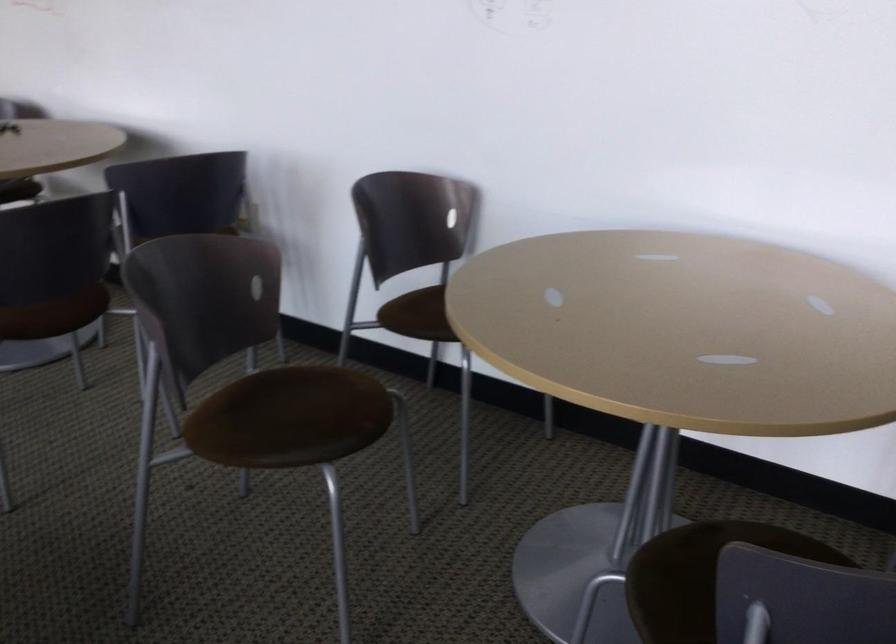
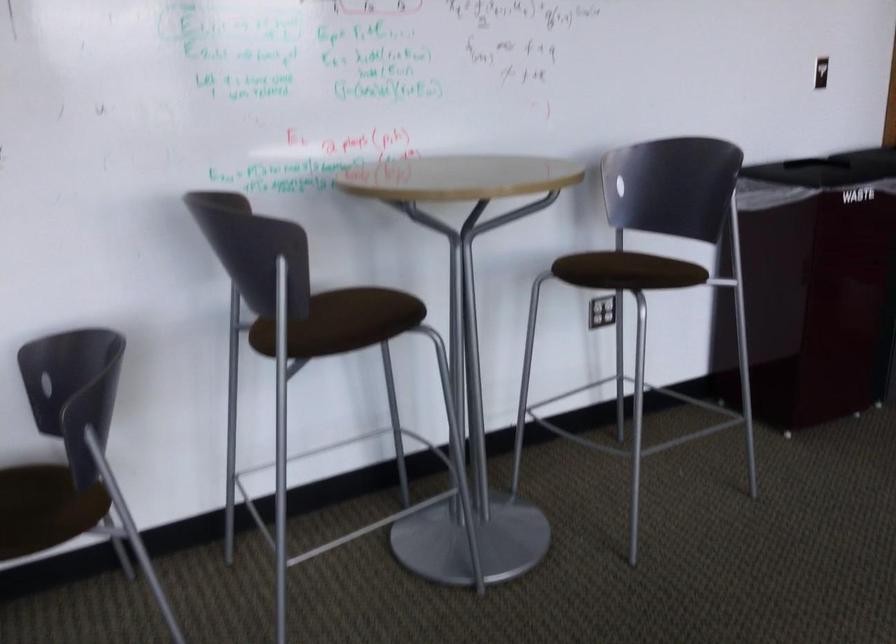
Question: Based on the continuous images, in which direction is the camera rotating? Reply with the corresponding letter.

Choices:
 (A) Left
 (B) Right
 (C) Up
 (D) Down

Answer: (B)